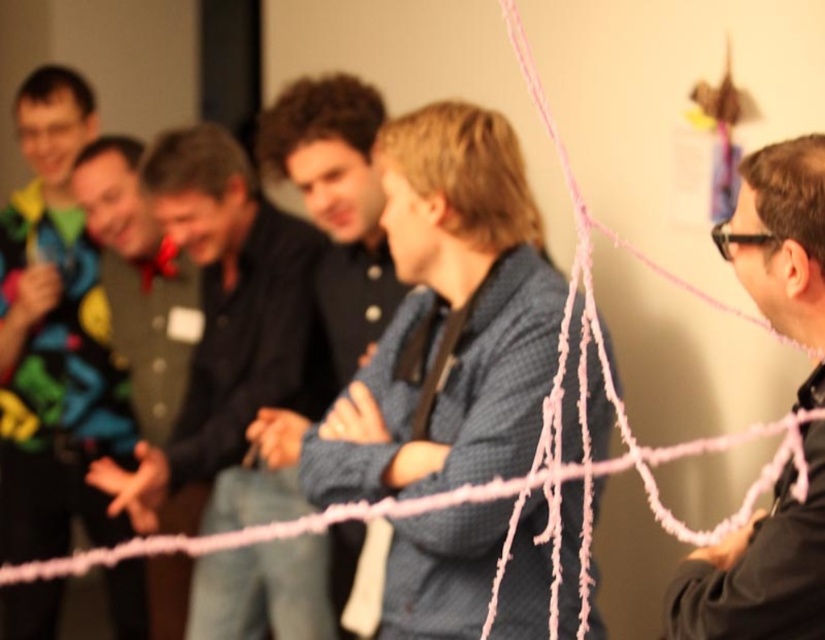
Question: Is blue textured shirt at center bigger than black plastic goggles at right?

Choices:
 (A) yes
 (B) no

Answer: (A)

Question: Considering the real-world distances, which object is closest to the black plastic goggles at right?

Choices:
 (A) dark brown leather jacket at center
 (B) multicolored fabric vest at left
 (C) blue textured shirt at center
 (D) dark blue shirt at center

Answer: (C)

Question: Which point is closer to the camera?

Choices:
 (A) black plastic goggles at right
 (B) black matte glasses at right
 (C) dark blue shirt at center

Answer: (B)

Question: Based on their relative distances, which object is farther from the blue textured shirt at center?

Choices:
 (A) black plastic goggles at right
 (B) dark brown leather jacket at center
 (C) black matte glasses at right

Answer: (B)

Question: Can you confirm if dark blue shirt at center is bigger than black plastic goggles at right?

Choices:
 (A) no
 (B) yes

Answer: (B)

Question: Does blue textured shirt at center have a larger size compared to matte black jacket at left?

Choices:
 (A) no
 (B) yes

Answer: (A)